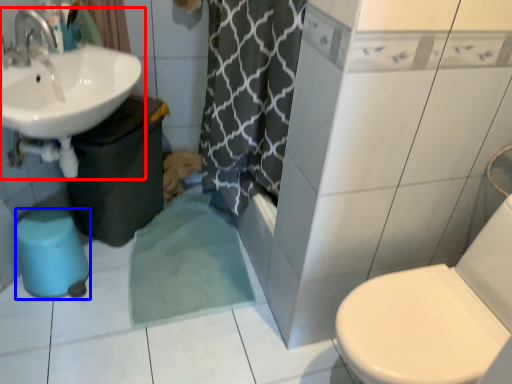
Question: Which object is further to the camera taking this photo, sink (highlighted by a red box) or bidet (highlighted by a blue box)?

Choices:
 (A) sink
 (B) bidet

Answer: (B)